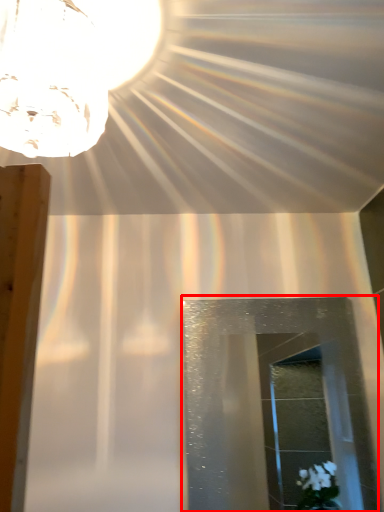
Question: From the image's perspective, where is glass door (annotated by the red box) located relative to lamp?

Choices:
 (A) above
 (B) below

Answer: (B)